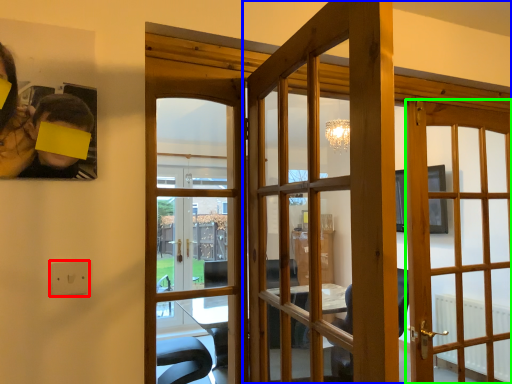
Question: Considering the real-world distances, which object is farthest from electric outlet (highlighted by a red box)? door (highlighted by a blue box) or door (highlighted by a green box)?

Choices:
 (A) door
 (B) door

Answer: (B)